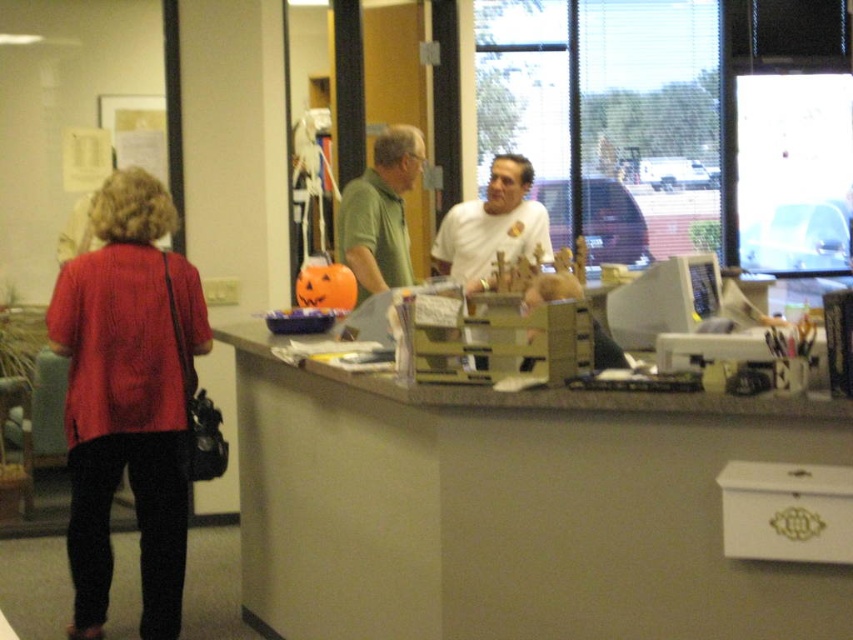
Question: Is matte gray desk at center wider than white matte shirt at center?

Choices:
 (A) no
 (B) yes

Answer: (B)

Question: Which object is the farthest from the matte red blouse at left?

Choices:
 (A) white matte shirt at center
 (B) green matte shirt at center

Answer: (A)

Question: Which of the following is the farthest from the observer?

Choices:
 (A) matte red blouse at left
 (B) white matte shirt at center
 (C) green matte shirt at center

Answer: (B)

Question: Among these points, which one is farthest from the camera?

Choices:
 (A) (601, 524)
 (B) (173, 630)
 (C) (378, 164)
 (D) (445, 269)

Answer: (D)

Question: Does matte gray desk at center come in front of matte red blouse at left?

Choices:
 (A) no
 (B) yes

Answer: (B)

Question: Is matte gray desk at center further to camera compared to matte red blouse at left?

Choices:
 (A) no
 (B) yes

Answer: (A)